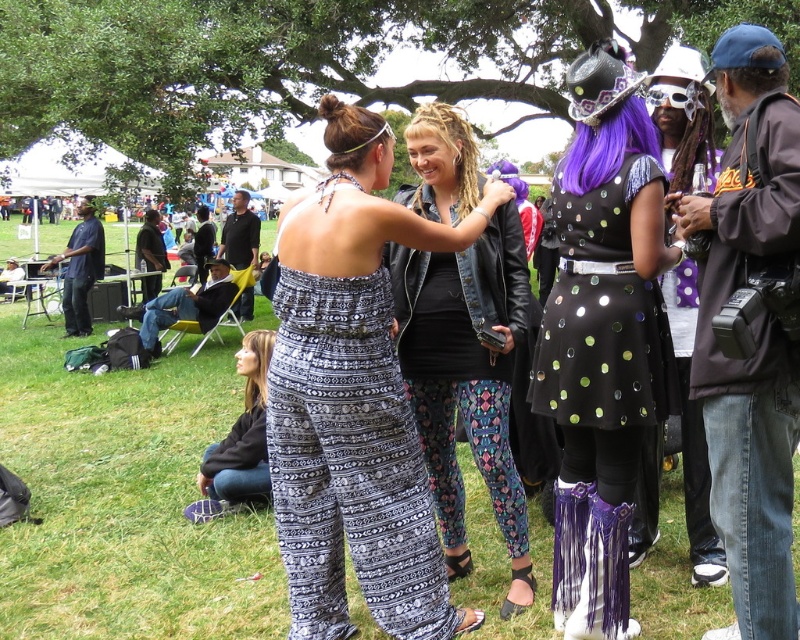
Is green grass at center smaller than sparkly black dress at center?

No.

What do you see at coordinates (126, 499) in the screenshot? I see `green grass at center` at bounding box center [126, 499].

At what (x,y) coordinates should I click in order to perform the action: click on green grass at center. Please return your answer as a coordinate pair (x, y). Looking at the image, I should click on (126, 499).

Consider the image. Does sparkly black dress at center come behind shiny sequined dress at center?

Yes, it is behind shiny sequined dress at center.

Is point (664, 246) more distant than point (582, 362)?

That is True.

The image size is (800, 640). I want to click on sparkly black dress at center, so click(602, 337).

You are a GUI agent. You are given a task and a screenshot of the screen. Output one action in this format:
    pyautogui.click(x=<x>, y=<y>)
    Task: Click on the sparkly black dress at center
    
    Given the screenshot: What is the action you would take?
    pyautogui.click(x=602, y=337)

Which is in front, point (409, 376) or point (590, 314)?

Point (590, 314) is more forward.

Which is behind, point (496, 497) or point (636, 280)?

Positioned behind is point (496, 497).

I want to click on printed fabric pants at center, so click(468, 378).